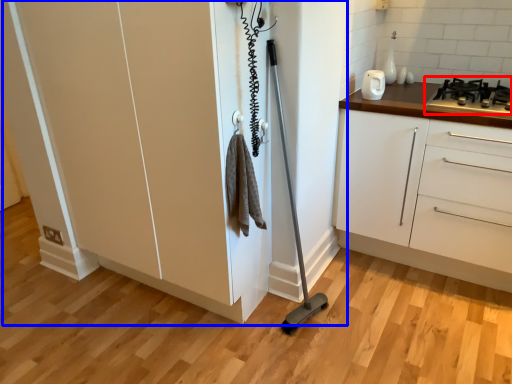
Question: Among these objects, which one is farthest to the camera, gas stove (highlighted by a red box) or cupboard (highlighted by a blue box)?

Choices:
 (A) gas stove
 (B) cupboard

Answer: (A)